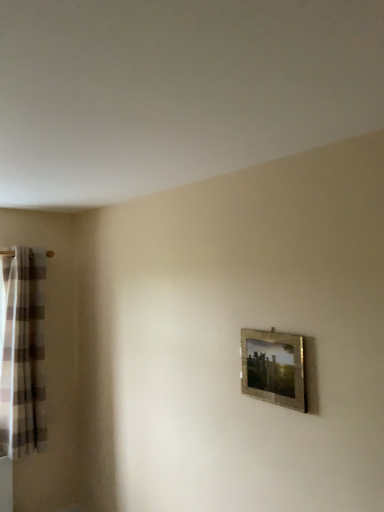
The width and height of the screenshot is (384, 512). Identify the location of gold textured frame at center right. (273, 367).

Describe the element at coordinates (273, 367) in the screenshot. I see `gold textured frame at center right` at that location.

In order to face gold textured frame at center right, should I rotate leftwards or rightwards?

Turn right approximately 10.796 degrees to face it.

The image size is (384, 512). What do you see at coordinates (22, 352) in the screenshot?
I see `plaid fabric curtain at left` at bounding box center [22, 352].

Where is `plaid fabric curtain at left`? The height and width of the screenshot is (512, 384). plaid fabric curtain at left is located at coordinates (22, 352).

The image size is (384, 512). I want to click on gold textured frame at center right, so click(273, 367).

Between gold textured frame at center right and plaid fabric curtain at left, which one appears on the right side from the viewer's perspective?

gold textured frame at center right.

Which object is closer to the camera taking this photo, gold textured frame at center right or plaid fabric curtain at left?

Positioned in front is gold textured frame at center right.

Which is closer, (294, 380) or (5, 309)?

Point (294, 380) is positioned closer to the camera compared to point (5, 309).

In the scene shown: From the image's perspective, between gold textured frame at center right and plaid fabric curtain at left, who is located below?

plaid fabric curtain at left.

From a real-world perspective, which is physically above, gold textured frame at center right or plaid fabric curtain at left?

gold textured frame at center right.

Which of these two, gold textured frame at center right or plaid fabric curtain at left, is thinner?

gold textured frame at center right.

Is gold textured frame at center right shorter than plaid fabric curtain at left?

Indeed, gold textured frame at center right has a lesser height compared to plaid fabric curtain at left.

Which of these two, gold textured frame at center right or plaid fabric curtain at left, is smaller?

gold textured frame at center right is smaller.

Is plaid fabric curtain at left inside gold textured frame at center right?

No, gold textured frame at center right does not contain plaid fabric curtain at left.

Is gold textured frame at center right not close to plaid fabric curtain at left?

Yes, gold textured frame at center right is far from plaid fabric curtain at left.

Is gold textured frame at center right turned away from plaid fabric curtain at left?

No, gold textured frame at center right is not facing away from plaid fabric curtain at left.

How many degrees apart are the facing directions of gold textured frame at center right and plaid fabric curtain at left?

They differ by 90 degrees in their facing directions.

Measure the distance between gold textured frame at center right and plaid fabric curtain at left.

A distance of 5.95 feet exists between gold textured frame at center right and plaid fabric curtain at left.

In the image, there is a gold textured frame at center right. Find the location of `curtain below it (from the image's perspective)`. curtain below it (from the image's perspective) is located at coordinates (22, 352).

Considering the positions of objects plaid fabric curtain at left and gold textured frame at center right in the image provided, who is more to the left, plaid fabric curtain at left or gold textured frame at center right?

plaid fabric curtain at left.

Is plaid fabric curtain at left in front of or behind gold textured frame at center right in the image?

plaid fabric curtain at left is behind gold textured frame at center right.

Between point (27, 352) and point (271, 370), which one is positioned behind?

The point (27, 352) is more distant.

From the image's perspective, between plaid fabric curtain at left and gold textured frame at center right, who is located below?

plaid fabric curtain at left is shown below in the image.

From a real-world perspective, is plaid fabric curtain at left located beneath gold textured frame at center right?

Yes, from a real-world perspective, plaid fabric curtain at left is beneath gold textured frame at center right.

Does plaid fabric curtain at left have a lesser width compared to gold textured frame at center right?

In fact, plaid fabric curtain at left might be wider than gold textured frame at center right.

Consider the image. Which of these two, plaid fabric curtain at left or gold textured frame at center right, stands taller?

plaid fabric curtain at left.

Which of these two, plaid fabric curtain at left or gold textured frame at center right, is smaller?

With smaller size is gold textured frame at center right.

Could gold textured frame at center right be considered to be inside plaid fabric curtain at left?

No, plaid fabric curtain at left does not contain gold textured frame at center right.

Is plaid fabric curtain at left touching gold textured frame at center right?

plaid fabric curtain at left is not next to gold textured frame at center right, and they're not touching.

Looking at this image, is plaid fabric curtain at left positioned with its back to gold textured frame at center right?

No, plaid fabric curtain at left is not facing the opposite direction of gold textured frame at center right.

What's the angular difference between plaid fabric curtain at left and gold textured frame at center right's facing directions?

90 degrees separate the facing orientations of plaid fabric curtain at left and gold textured frame at center right.

Identify the location of curtain lying behind the gold textured frame at center right. This screenshot has width=384, height=512. (22, 352).

This screenshot has width=384, height=512. I want to click on picture frame above the plaid fabric curtain at left (from the image's perspective), so click(x=273, y=367).

Find the location of a particular element. The width and height of the screenshot is (384, 512). picture frame above the plaid fabric curtain at left (from a real-world perspective) is located at coordinates (273, 367).